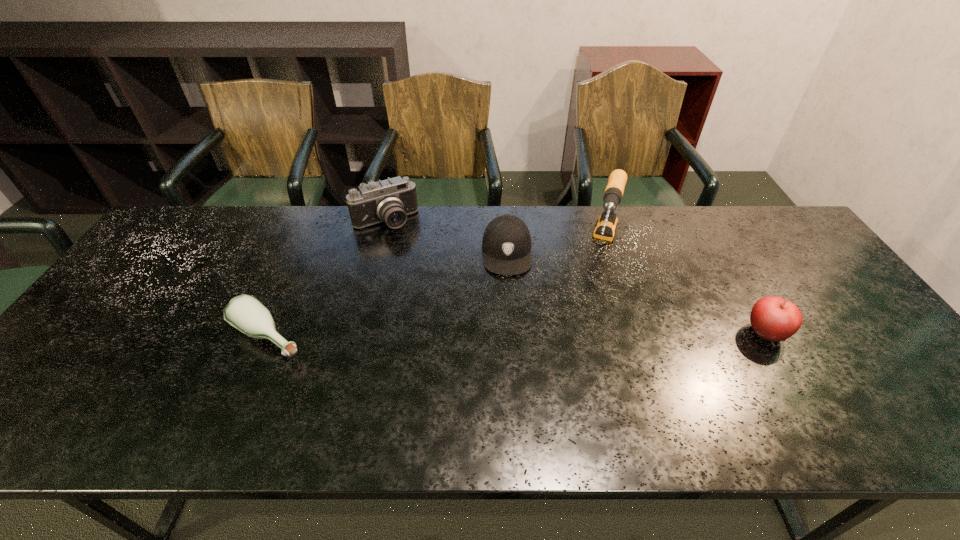
I want to click on free space between the apple and the cap, so [x=636, y=293].

This screenshot has width=960, height=540. In order to click on free spot between the cap and the rightmost object in this screenshot , I will do `click(636, 293)`.

Locate an element on the screen. The height and width of the screenshot is (540, 960). empty location between the shortest object and the second object from right to left is located at coordinates (436, 290).

At what (x,y) coordinates should I click in order to perform the action: click on blank region between the third object from right to left and the leftmost object. Please return your answer as a coordinate pair (x, y). This screenshot has height=540, width=960. Looking at the image, I should click on (388, 294).

You are a GUI agent. You are given a task and a screenshot of the screen. Output one action in this format:
    pyautogui.click(x=<x>, y=<y>)
    Task: Click on the free space between the leftmost object and the cap
    This screenshot has height=540, width=960.
    Given the screenshot: What is the action you would take?
    pyautogui.click(x=388, y=294)

This screenshot has height=540, width=960. I want to click on free spot between the apple and the tallest object, so click(684, 288).

Point out which object is positioned as the nearest to the third object from left to right. Please provide its 2D coordinates. Your answer should be formatted as a tuple, i.e. [(x, y)], where the tuple contains the x and y coordinates of a point satisfying the conditions above.

[(606, 225)]

The height and width of the screenshot is (540, 960). Find the location of `object that ranks as the third closest to the cap`. object that ranks as the third closest to the cap is located at coordinates (246, 313).

Find the location of a particular element. The width and height of the screenshot is (960, 540). vacant space that satisfies the following two spatial constraints: 1. on the back side of the leftmost object; 2. on the right side of the drill is located at coordinates (309, 244).

You are a GUI agent. You are given a task and a screenshot of the screen. Output one action in this format:
    pyautogui.click(x=<x>, y=<y>)
    Task: Click on the vacant space that satisfies the following two spatial constraints: 1. on the front side of the rightmost object; 2. on the left side of the tallest object
    
    Given the screenshot: What is the action you would take?
    pyautogui.click(x=632, y=333)